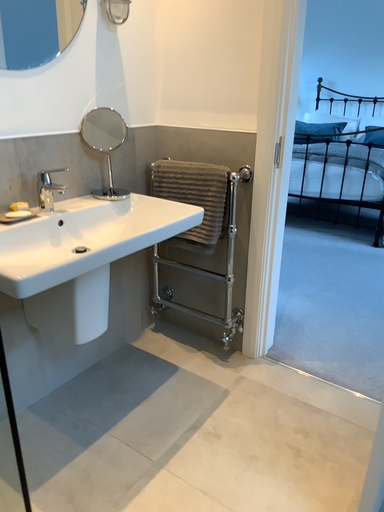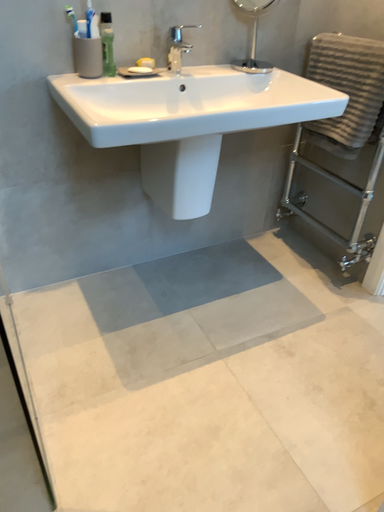
Question: How did the camera likely rotate when shooting the video?

Choices:
 (A) rotated downward
 (B) rotated upward

Answer: (A)